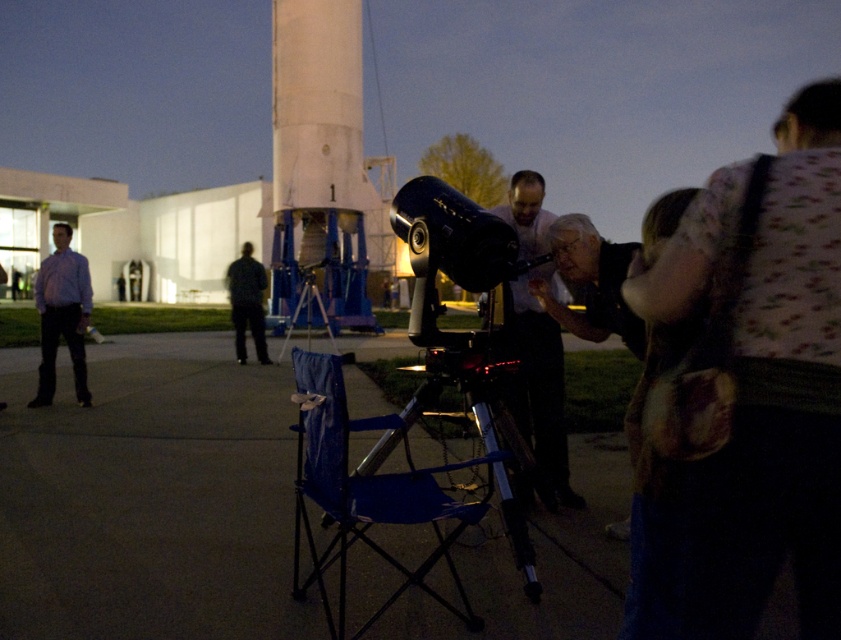
You are standing at the origin point of the image coordinate system and want to move towards the blue fabric chair at lower center. What are the coordinates you need to move to reach it?

The coordinates to reach the blue fabric chair at lower center are at point (384,492).

You are standing at the origin point of the coordinate system in this image. You want to walk towards the white matte rocket at center. What direction should you move in?

The white matte rocket at center is located at coordinates point (321, 163), so you should move towards the direction of the point (321, 163) to reach it.

Consider the image. You are a maintenance worker who needs to reach the white matte rocket at center from your current position near the dark gray fabric pants at lower left. Given that your tool box is 2 meters long, can you carry it horizontally while walking towards the rocket without dropping it?

The distance between the white matte rocket at center and the dark gray fabric pants at lower left is 6.86 meters. Since the tool box is only 2 meters long, you can carry it horizontally without any issue as the distance is sufficient.